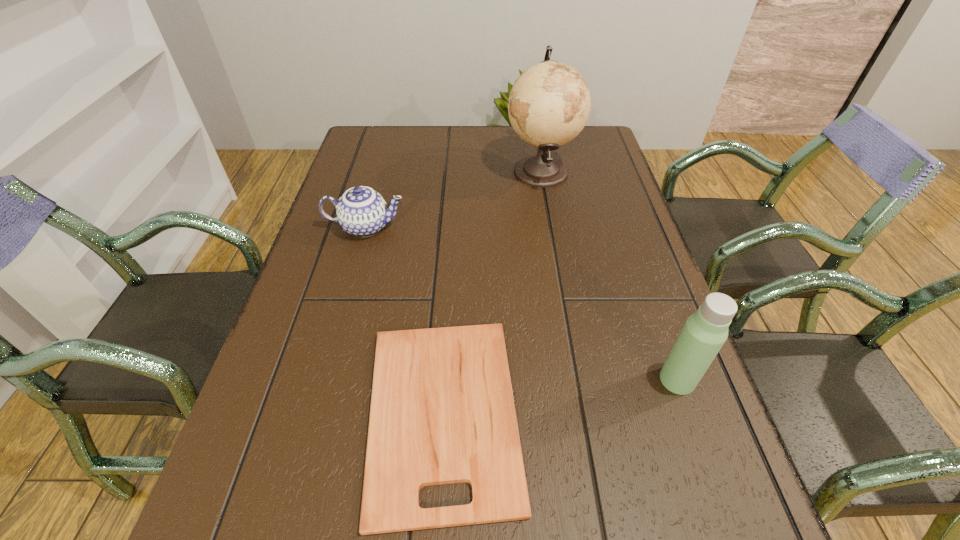
Locate an element on the screen. globe is located at coordinates coord(549,104).

Locate an element on the screen. This screenshot has width=960, height=540. the tallest object is located at coordinates (549, 104).

You are a GUI agent. You are given a task and a screenshot of the screen. Output one action in this format:
    pyautogui.click(x=<x>, y=<y>)
    Task: Click on the thermos bottle
    The width and height of the screenshot is (960, 540).
    Given the screenshot: What is the action you would take?
    pyautogui.click(x=704, y=333)

Find the location of a particular element. The height and width of the screenshot is (540, 960). the rightmost object is located at coordinates (704, 333).

Locate an element on the screen. The width and height of the screenshot is (960, 540). the second farthest object is located at coordinates (361, 211).

Where is `the third tallest object`? The width and height of the screenshot is (960, 540). the third tallest object is located at coordinates (361, 211).

Where is `the shortest object`? The image size is (960, 540). the shortest object is located at coordinates (442, 411).

The height and width of the screenshot is (540, 960). I want to click on free location located 0.330m on the front-facing side of the farthest object, so click(x=395, y=171).

Locate an element on the screen. The image size is (960, 540). vacant region located 0.360m on the front-facing side of the farthest object is located at coordinates (384, 171).

Identify the location of blank space located on the front-facing side of the farthest object. (404, 171).